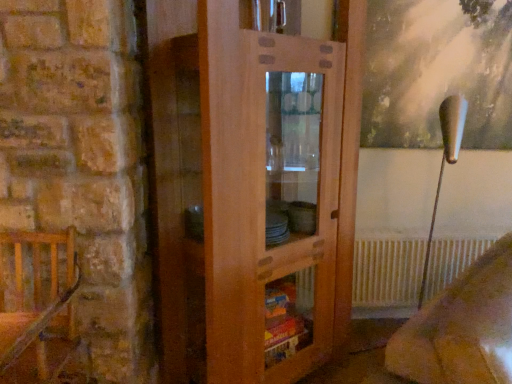
This screenshot has width=512, height=384. What do you see at coordinates (252, 187) in the screenshot?
I see `wooden cabinet at center` at bounding box center [252, 187].

The height and width of the screenshot is (384, 512). Find the location of `white metallic radiator at lower right`. white metallic radiator at lower right is located at coordinates (387, 272).

What do you see at coordinates (461, 328) in the screenshot? I see `velvet beige armchair at lower right` at bounding box center [461, 328].

Looking at this image, measure the distance between velvet beige armchair at lower right and camera.

velvet beige armchair at lower right is 35.33 inches away from camera.

In order to click on wooden cabinet at center in this screenshot , I will do `click(252, 187)`.

Do you think white metallic radiator at lower right is within wooden chair at left, or outside of it?

white metallic radiator at lower right is located beyond the bounds of wooden chair at left.

Is white metallic radiator at lower right bigger than wooden chair at left?

No.

What's the angular difference between white metallic radiator at lower right and wooden chair at left's facing directions?

2.23 degrees separate the facing orientations of white metallic radiator at lower right and wooden chair at left.

Considering the positions of points (304, 300) and (67, 267), is point (304, 300) farther from camera compared to point (67, 267)?

Yes.

From a real-world perspective, is wooden chair at left physically above wooden cabinet at center?

Actually, wooden chair at left is physically below wooden cabinet at center in the real world.

Between point (45, 312) and point (226, 321), which one is positioned behind?

The point (226, 321) is farther.

I want to click on dresser behind the wooden chair at left, so click(x=252, y=187).

Looking at this image, how different are the orientations of wooden chair at left and wooden cabinet at center in degrees?

42.3 degrees.

From a real-world perspective, is white metallic radiator at lower right physically located above or below wooden cabinet at center?

In terms of real-world spatial position, white metallic radiator at lower right is below wooden cabinet at center.

Is white metallic radiator at lower right further to the viewer compared to wooden cabinet at center?

Yes, white metallic radiator at lower right is further from the camera.

Is wooden cabinet at center located within white metallic radiator at lower right?

No, wooden cabinet at center is located outside of white metallic radiator at lower right.

In the scene shown: Is white metallic radiator at lower right facing towards wooden cabinet at center?

No.

Consider the image. From a real-world perspective, is white metallic radiator at lower right above or below velvet beige armchair at lower right?

From a real-world perspective, white metallic radiator at lower right is physically below velvet beige armchair at lower right.

This screenshot has width=512, height=384. I want to click on radiator located behind the velvet beige armchair at lower right, so click(x=387, y=272).

From the image's perspective, which one is positioned lower, white metallic radiator at lower right or velvet beige armchair at lower right?

velvet beige armchair at lower right is shown below in the image.

Which is more to the right, white metallic radiator at lower right or velvet beige armchair at lower right?

From the viewer's perspective, white metallic radiator at lower right appears more on the right side.

Considering the positions of objects velvet beige armchair at lower right and wooden cabinet at center in the image provided, who is in front, velvet beige armchair at lower right or wooden cabinet at center?

velvet beige armchair at lower right.

From a real-world perspective, is velvet beige armchair at lower right positioned under wooden cabinet at center based on gravity?

Yes, from a real-world perspective, velvet beige armchair at lower right is under wooden cabinet at center.

Between velvet beige armchair at lower right and wooden cabinet at center, which one appears on the left side from the viewer's perspective?

Positioned to the left is wooden cabinet at center.

Considering the relative sizes of velvet beige armchair at lower right and wooden chair at left in the image provided, is velvet beige armchair at lower right shorter than wooden chair at left?

Incorrect, the height of velvet beige armchair at lower right does not fall short of that of wooden chair at left.

Looking at this image, considering the relative positions of velvet beige armchair at lower right and wooden chair at left in the image provided, is velvet beige armchair at lower right behind wooden chair at left?

No, the depth of velvet beige armchair at lower right is less than that of wooden chair at left.

Who is smaller, velvet beige armchair at lower right or wooden chair at left?

Smaller between the two is wooden chair at left.

Which object is wider, wooden chair at left or velvet beige armchair at lower right?

wooden chair at left is wider.

Does wooden chair at left have a greater height compared to velvet beige armchair at lower right?

No, wooden chair at left is not taller than velvet beige armchair at lower right.

Between wooden chair at left and velvet beige armchair at lower right, which one has smaller size?

wooden chair at left is smaller.

Locate an element on the screen. The image size is (512, 384). furniture that appears on the left of white metallic radiator at lower right is located at coordinates (37, 305).

Where is `dresser on the right of wooden chair at left`? The height and width of the screenshot is (384, 512). dresser on the right of wooden chair at left is located at coordinates (252, 187).

Estimate the real-world distances between objects in this image. Which object is closer to wooden chair at left, wooden cabinet at center or velvet beige armchair at lower right?

wooden cabinet at center lies closer to wooden chair at left than the other object.

Estimate the real-world distances between objects in this image. Which object is closer to white metallic radiator at lower right, wooden cabinet at center or wooden chair at left?

The object closer to white metallic radiator at lower right is wooden cabinet at center.

From the image, which object appears to be nearer to velvet beige armchair at lower right, wooden cabinet at center or white metallic radiator at lower right?

wooden cabinet at center is closer to velvet beige armchair at lower right.

Based on their spatial positions, is wooden cabinet at center or white metallic radiator at lower right further from wooden chair at left?

white metallic radiator at lower right lies further to wooden chair at left than the other object.

Based on their spatial positions, is wooden chair at left or velvet beige armchair at lower right closer to white metallic radiator at lower right?

Based on the image, velvet beige armchair at lower right appears to be nearer to white metallic radiator at lower right.

Based on the photo, based on their spatial positions, is wooden chair at left or wooden cabinet at center closer to white metallic radiator at lower right?

The object closer to white metallic radiator at lower right is wooden cabinet at center.

When comparing their distances from wooden cabinet at center, does velvet beige armchair at lower right or white metallic radiator at lower right seem further?

white metallic radiator at lower right is positioned further to the anchor wooden cabinet at center.

Considering their positions, is wooden cabinet at center positioned closer to velvet beige armchair at lower right than wooden chair at left?

wooden cabinet at center lies closer to velvet beige armchair at lower right than the other object.

Image resolution: width=512 pixels, height=384 pixels. I want to click on dresser between wooden chair at left and velvet beige armchair at lower right, so click(252, 187).

The width and height of the screenshot is (512, 384). I want to click on dresser located between velvet beige armchair at lower right and white metallic radiator at lower right in the depth direction, so click(x=252, y=187).

Where is `dresser between wooden chair at left and white metallic radiator at lower right in the horizontal direction`? The width and height of the screenshot is (512, 384). dresser between wooden chair at left and white metallic radiator at lower right in the horizontal direction is located at coordinates (252, 187).

You are a GUI agent. You are given a task and a screenshot of the screen. Output one action in this format:
    pyautogui.click(x=<x>, y=<y>)
    Task: Click on the armchair between wooden chair at left and white metallic radiator at lower right in the horizontal direction
    The height and width of the screenshot is (384, 512).
    Given the screenshot: What is the action you would take?
    pyautogui.click(x=461, y=328)